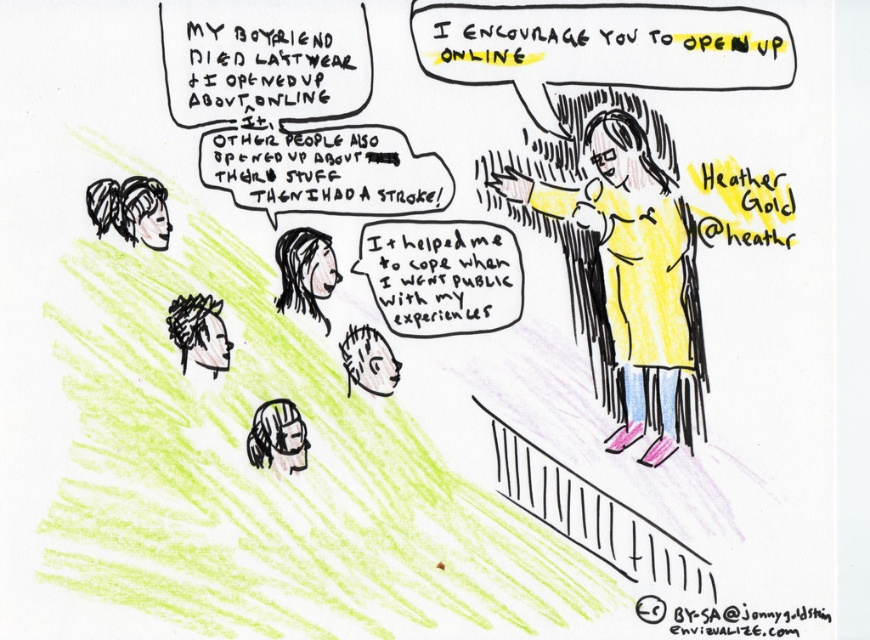
You are attending a public event and want to locate the speaker. Based on the image, which object is positioned lower between the yellow matte shirt at upper right and the black hair at upper left?

The yellow matte shirt at upper right is positioned below the black hair at upper left, so the yellow matte shirt at upper right is lower.

You are a photographer at this event and need to capture a photo that includes both the yellow matte shirt at upper right and the black hair at upper left. Your camera has a maximum focus range of 16 inches. Will you be able to fit both subjects within the frame without moving closer?

The distance between the yellow matte shirt at upper right and the black hair at upper left is 16.73 inches. Since the camera can only focus up to 16 inches, the subjects are slightly out of range. You might need to move closer to ensure both are in focus.